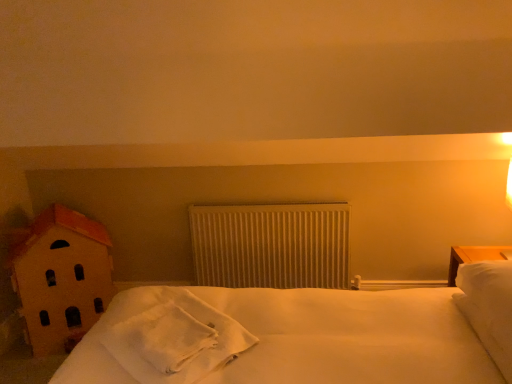
Image resolution: width=512 pixels, height=384 pixels. I want to click on empty space that is ontop of white soft towel at center (from a real-world perspective), so (170, 335).